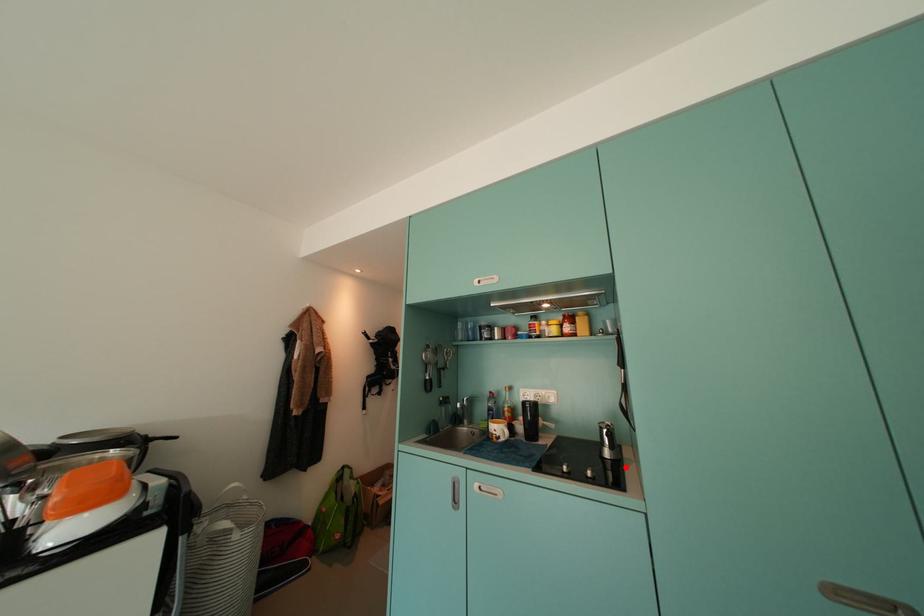
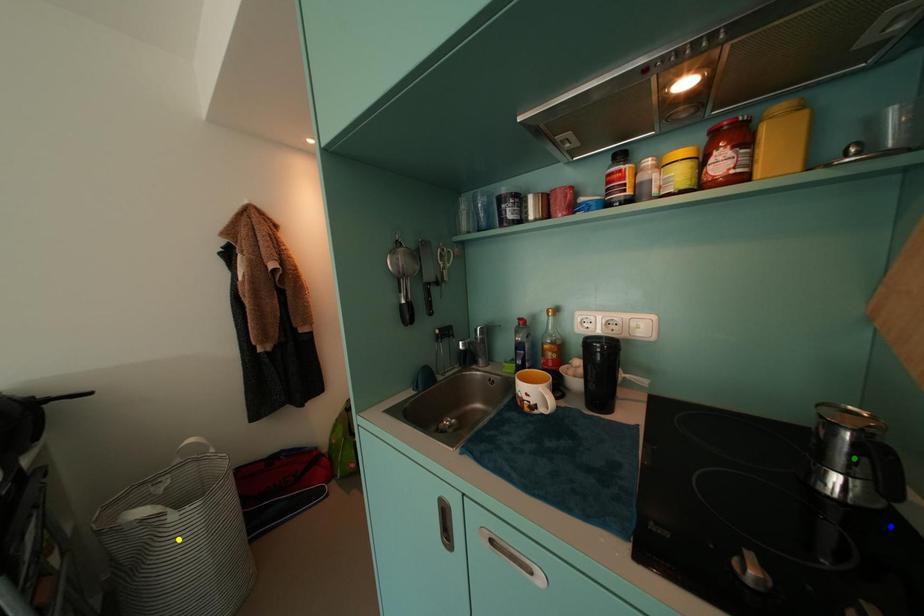
Question: I am providing you with two images of the same scene from different viewpoints. A red point is marked on the first image. You are given multiple points on the second image. Which spot in image 2 lines up with the point in image 1?

Choices:
 (A) blue point
 (B) green point
 (C) yellow point

Answer: (A)